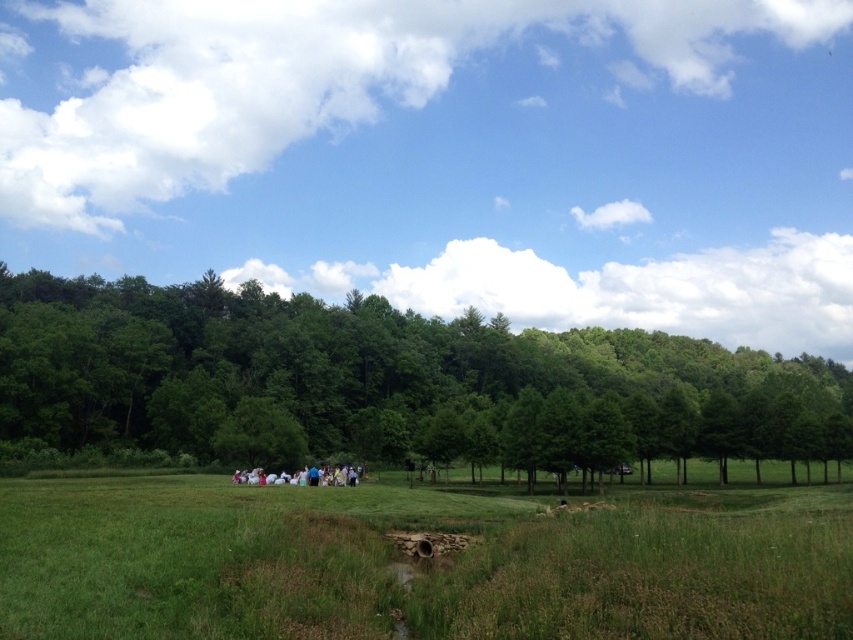
Is green grassy field at center to the right of white cotton dress at center from the viewer's perspective?

Correct, you'll find green grassy field at center to the right of white cotton dress at center.

This screenshot has height=640, width=853. What do you see at coordinates (418, 563) in the screenshot?
I see `green grassy field at center` at bounding box center [418, 563].

This screenshot has height=640, width=853. Identify the location of green grassy field at center. (418, 563).

Who is lower down, green grassy field at center or green leafy tree at center?

green grassy field at center is below.

Does point (202, 477) come farther from viewer compared to point (76, 349)?

No.

This screenshot has width=853, height=640. What are the coordinates of `green grassy field at center` in the screenshot? It's located at (418, 563).

This screenshot has width=853, height=640. I want to click on green grassy field at center, so click(x=418, y=563).

Between green leafy tree at center and white cotton dress at center, which one has less height?

Standing shorter between the two is white cotton dress at center.

Which is more to the right, green leafy tree at center or white cotton dress at center?

green leafy tree at center

Is point (10, 298) in front of point (347, 467)?

That is False.

Locate an element on the screen. green leafy tree at center is located at coordinates (392, 385).